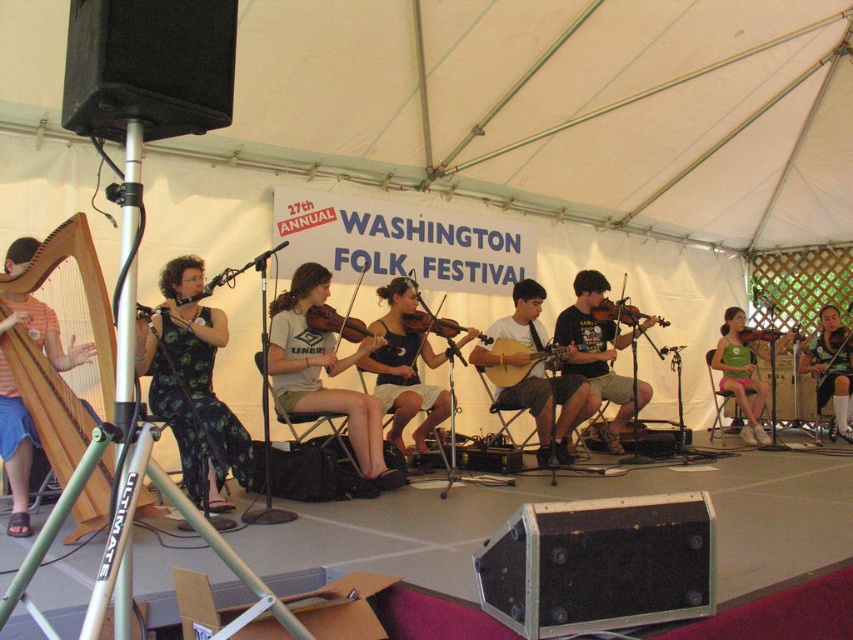
You are a photographer at the festival. You want to capture a photo of the violinist. The wooden violin at center is in focus, but the light gray cotton shirt at center is slightly out of focus. Why might this be happening?

The light gray cotton shirt at center is located below the wooden violin at center. Since the violin is in focus, the shirt is out of focus because it is positioned behind the violin in the depth of field.

You are a photographer at the festival and want to capture a clear shot of both the green floral dress at center and the black fabric dress at center. Since you can only focus on one subject at a time, which dress should you focus on to ensure the other is still in the background?

You should focus on the green floral dress at center because it is closer to the viewer, so the black fabric dress at center will naturally be in the background and still visible.